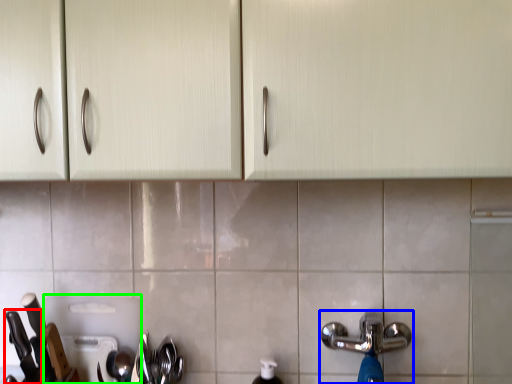
Question: Estimate the real-world distances between objects in this image. Which object is closer to knife (highlighted by a red box), tap (highlighted by a blue box) or appliance (highlighted by a green box)?

Choices:
 (A) tap
 (B) appliance

Answer: (B)